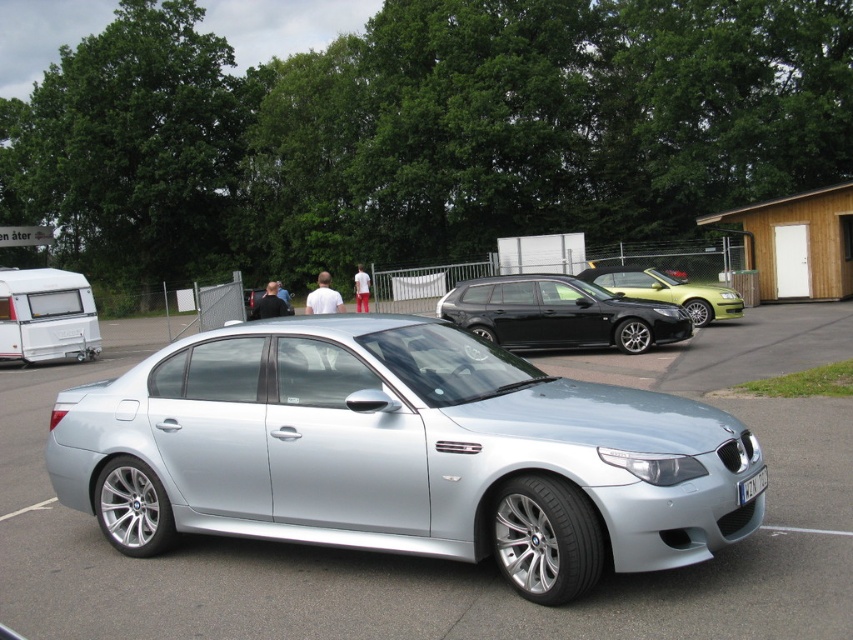
Does white matte camper at left appear on the left side of white plastic license plate at center?

Correct, you'll find white matte camper at left to the left of white plastic license plate at center.

Does white matte camper at left have a greater width compared to white plastic license plate at center?

Yes, white matte camper at left is wider than white plastic license plate at center.

Is point (39, 328) in front of point (746, 492)?

That is False.

The height and width of the screenshot is (640, 853). I want to click on white matte camper at left, so (45, 316).

Can you confirm if metallic green car at center is bigger than white plastic license plate at center?

Yes.

Consider the image. Which of these two, metallic green car at center or white plastic license plate at center, stands taller?

With more height is metallic green car at center.

Which is behind, point (624, 266) or point (753, 483)?

The point (624, 266) is more distant.

Where is `metallic green car at center`? The image size is (853, 640). metallic green car at center is located at coordinates (666, 291).

Does satin silver car at center appear on the right side of white plastic license plate at center?

In fact, satin silver car at center is to the left of white plastic license plate at center.

Who is more distant from viewer, (347, 440) or (743, 499)?

Positioned behind is point (347, 440).

You are a GUI agent. You are given a task and a screenshot of the screen. Output one action in this format:
    pyautogui.click(x=<x>, y=<y>)
    Task: Click on the satin silver car at center
    
    Given the screenshot: What is the action you would take?
    pyautogui.click(x=401, y=452)